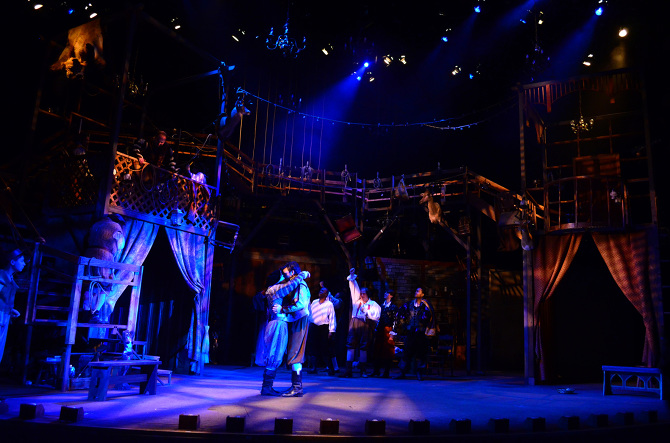
In order to click on bench in this screenshot , I will do `click(108, 364)`.